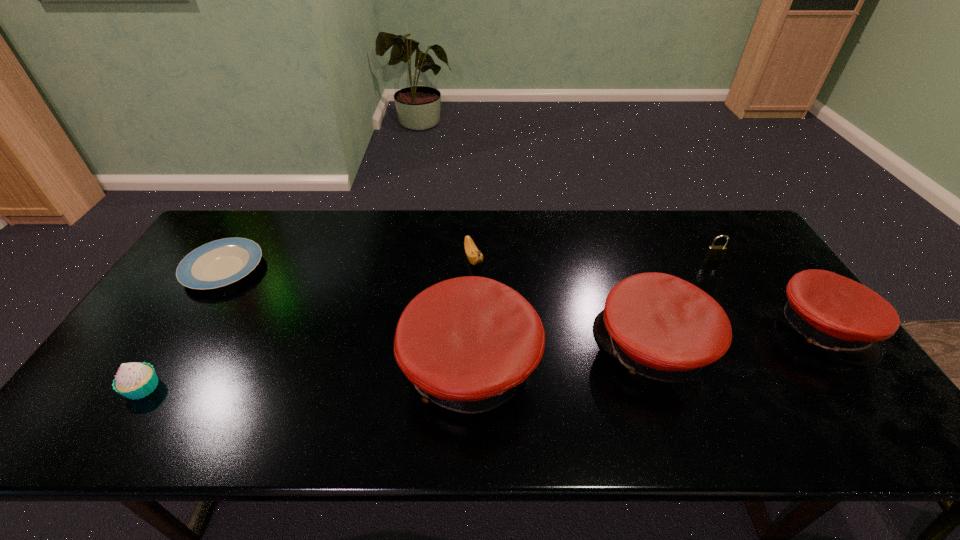
Locate which object ranks fifth in proximity to the fifth shortest object. Please provide its 2D coordinates. Your answer should be formatted as a tuple, i.e. [(x, y)], where the tuple contains the x and y coordinates of a point satisfying the conditions above.

[(221, 262)]

Locate an element on the screen. This screenshot has height=540, width=960. cap object that ranks as the second closest to the rightmost object is located at coordinates (467, 344).

Select which cap appears as the second closest to the fifth shortest object. Please provide its 2D coordinates. Your answer should be formatted as a tuple, i.e. [(x, y)], where the tuple contains the x and y coordinates of a point satisfying the conditions above.

[(467, 344)]

You are a GUI agent. You are given a task and a screenshot of the screen. Output one action in this format:
    pyautogui.click(x=<x>, y=<y>)
    Task: Click on the blank space that satisfies the following two spatial constraints: 1. on the front-facing side of the padlock; 2. at the front of the leftmost cap where the visor is located
    The width and height of the screenshot is (960, 540).
    Given the screenshot: What is the action you would take?
    pyautogui.click(x=778, y=368)